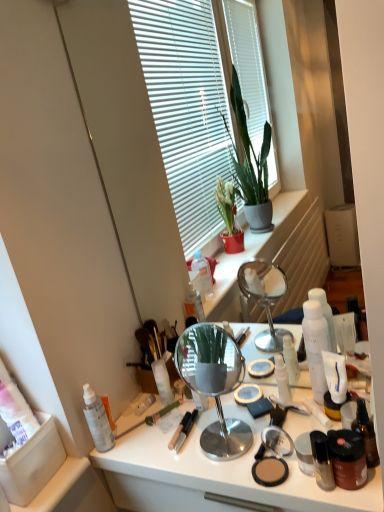
Locate an element on the screen. vacant area situated to the left side of white plastic container at center, the 6th toiletry when ordered from right to left is located at coordinates (132, 414).